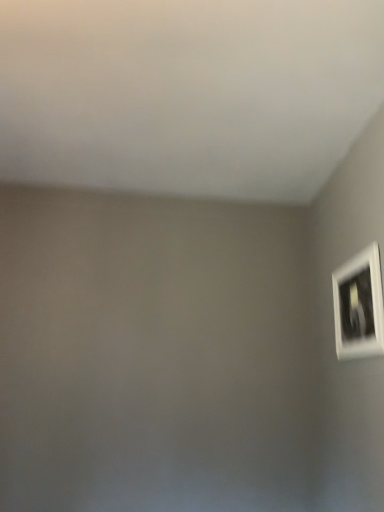
Identify the location of white matte picture frame at upper right. Image resolution: width=384 pixels, height=512 pixels. (359, 305).

This screenshot has height=512, width=384. Describe the element at coordinates (359, 305) in the screenshot. I see `white matte picture frame at upper right` at that location.

Where is `white matte picture frame at upper right`? white matte picture frame at upper right is located at coordinates (359, 305).